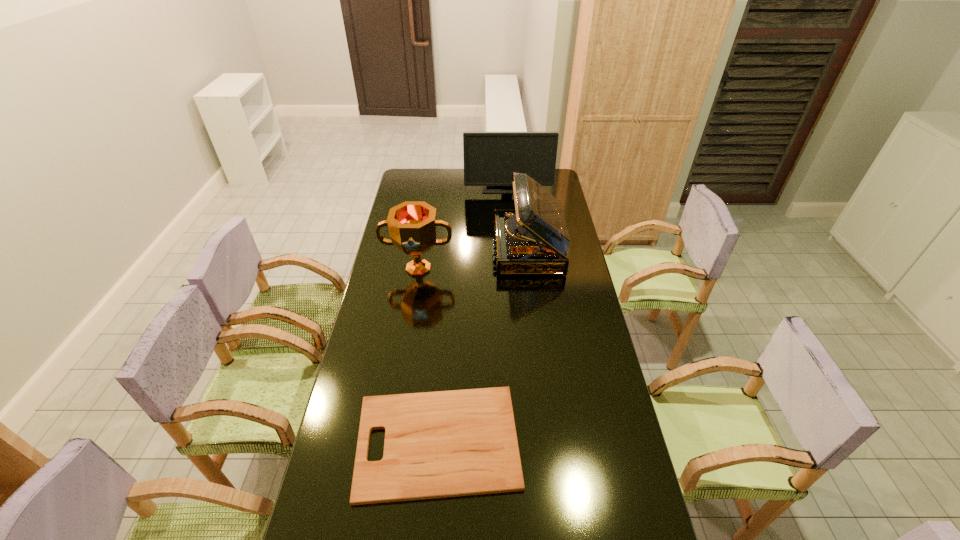
Find the location of a particular element. the farthest object is located at coordinates (490, 158).

What are the coordinates of `record player` in the screenshot? It's located at (533, 239).

You are a GUI agent. You are given a task and a screenshot of the screen. Output one action in this format:
    pyautogui.click(x=<x>, y=<y>)
    Task: Click on the award
    This screenshot has height=540, width=960.
    Given the screenshot: What is the action you would take?
    pyautogui.click(x=412, y=225)

Identify the location of the shortest object. Image resolution: width=960 pixels, height=540 pixels. (440, 444).

This screenshot has width=960, height=540. In order to click on chopping board in this screenshot , I will do point(440,444).

This screenshot has height=540, width=960. What are the coordinates of `free space located 0.190m on the screen side of the farthest object` in the screenshot? It's located at (511, 214).

The image size is (960, 540). Find the location of `vacant space situated 0.150m on the front-facing side of the record player`. vacant space situated 0.150m on the front-facing side of the record player is located at coordinates (459, 248).

Identify the location of free space located on the front-facing side of the record player. The width and height of the screenshot is (960, 540). (461, 248).

Where is `vacant space situated on the front-facing side of the record player`? The width and height of the screenshot is (960, 540). vacant space situated on the front-facing side of the record player is located at coordinates (448, 248).

The image size is (960, 540). I want to click on vacant space located on the side of the award with the star emblem, so click(x=404, y=357).